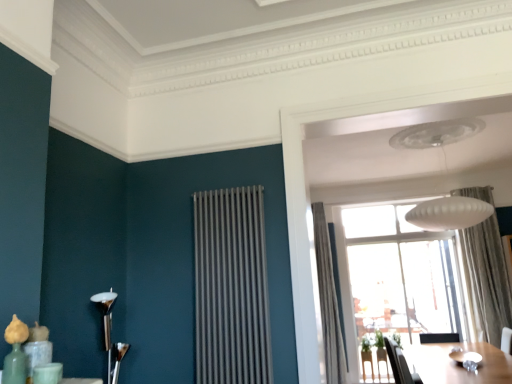
Question: Is black leather swivel chair at lower right far away from wooden table at lower right?

Choices:
 (A) no
 (B) yes

Answer: (A)

Question: From a real-world perspective, is black leather swivel chair at lower right on wooden table at lower right?

Choices:
 (A) no
 (B) yes

Answer: (B)

Question: Could you tell me if black leather swivel chair at lower right is facing wooden table at lower right?

Choices:
 (A) no
 (B) yes

Answer: (B)

Question: Is black leather swivel chair at lower right bigger than wooden table at lower right?

Choices:
 (A) no
 (B) yes

Answer: (A)

Question: Considering the relative sizes of black leather swivel chair at lower right and wooden table at lower right in the image provided, is black leather swivel chair at lower right smaller than wooden table at lower right?

Choices:
 (A) yes
 (B) no

Answer: (A)

Question: Considering their positions, is satin silver radiator at center located in front of or behind wooden table at lower right?

Choices:
 (A) front
 (B) behind

Answer: (A)

Question: Is satin silver radiator at center inside the boundaries of wooden table at lower right, or outside?

Choices:
 (A) inside
 (B) outside

Answer: (B)

Question: Considering the relative positions of satin silver radiator at center and wooden table at lower right in the image provided, is satin silver radiator at center to the left or to the right of wooden table at lower right?

Choices:
 (A) right
 (B) left

Answer: (B)

Question: From a real-world perspective, is satin silver radiator at center positioned above or below wooden table at lower right?

Choices:
 (A) below
 (B) above

Answer: (B)

Question: Is transparent glass window at center inside the boundaries of gray textured curtain at upper right, positioned as the second curtain in right-to-left order, or outside?

Choices:
 (A) inside
 (B) outside

Answer: (B)

Question: From the image's perspective, relative to gray textured curtain at upper right, positioned as the 1th curtain in left-to-right order, is transparent glass window at center above or below?

Choices:
 (A) above
 (B) below

Answer: (B)

Question: From a real-world perspective, relative to gray textured curtain at upper right, positioned as the second curtain in right-to-left order, is transparent glass window at center vertically above or below?

Choices:
 (A) above
 (B) below

Answer: (B)

Question: From their relative heights in the image, would you say transparent glass window at center is taller or shorter than gray textured curtain at upper right, positioned as the second curtain in right-to-left order?

Choices:
 (A) tall
 (B) short

Answer: (B)

Question: Which is correct: polished silver candlestick at left, which ranks as the first lamp in front-to-back order, is inside wooden table at lower right, or outside of it?

Choices:
 (A) inside
 (B) outside

Answer: (B)

Question: Considering the positions of polished silver candlestick at left, acting as the second lamp starting from the back, and wooden table at lower right in the image, is polished silver candlestick at left, acting as the second lamp starting from the back, wider or thinner than wooden table at lower right?

Choices:
 (A) wide
 (B) thin

Answer: (B)